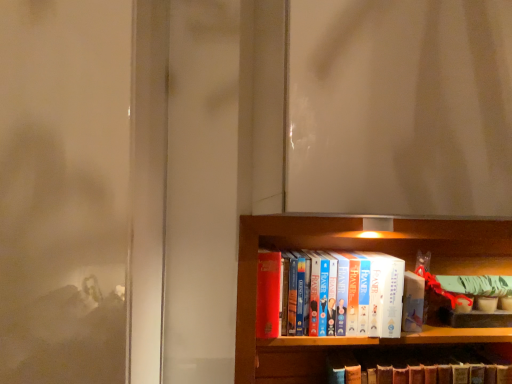
Question: From a real-world perspective, is hardcover book at center, placed as the first book when sorted from bottom to top, physically located above or below hardcover book at center, acting as the 2th book starting from the bottom?

Choices:
 (A) above
 (B) below

Answer: (B)

Question: Is point (364, 360) closer or farther from the camera than point (327, 327)?

Choices:
 (A) closer
 (B) farther

Answer: (B)

Question: From the image's perspective, is hardcover book at center, acting as the second book starting from the top, located above or below hardcover book at center, acting as the 2th book starting from the bottom?

Choices:
 (A) below
 (B) above

Answer: (A)

Question: From a real-world perspective, is hardcover book at center, acting as the 2th book starting from the bottom, physically located above or below hardcover book at center, acting as the second book starting from the top?

Choices:
 (A) below
 (B) above

Answer: (B)

Question: From their relative heights in the image, would you say hardcover book at center, positioned as the 1th book in top-to-bottom order, is taller or shorter than hardcover book at center, acting as the second book starting from the top?

Choices:
 (A) short
 (B) tall

Answer: (B)

Question: In the image, is hardcover book at center, acting as the 2th book starting from the bottom, positioned in front of or behind hardcover book at center, placed as the first book when sorted from bottom to top?

Choices:
 (A) front
 (B) behind

Answer: (A)

Question: Considering the positions of hardcover book at center, acting as the 2th book starting from the bottom, and hardcover book at center, placed as the first book when sorted from bottom to top, in the image, is hardcover book at center, acting as the 2th book starting from the bottom, wider or thinner than hardcover book at center, placed as the first book when sorted from bottom to top,?

Choices:
 (A) wide
 (B) thin

Answer: (A)